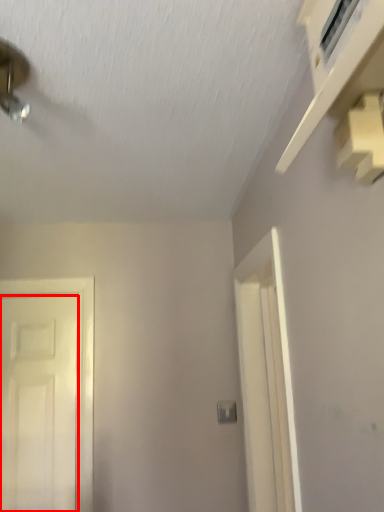
Question: Observing the image, what is the correct spatial positioning of door (annotated by the red box) in reference to light switch?

Choices:
 (A) left
 (B) right

Answer: (A)